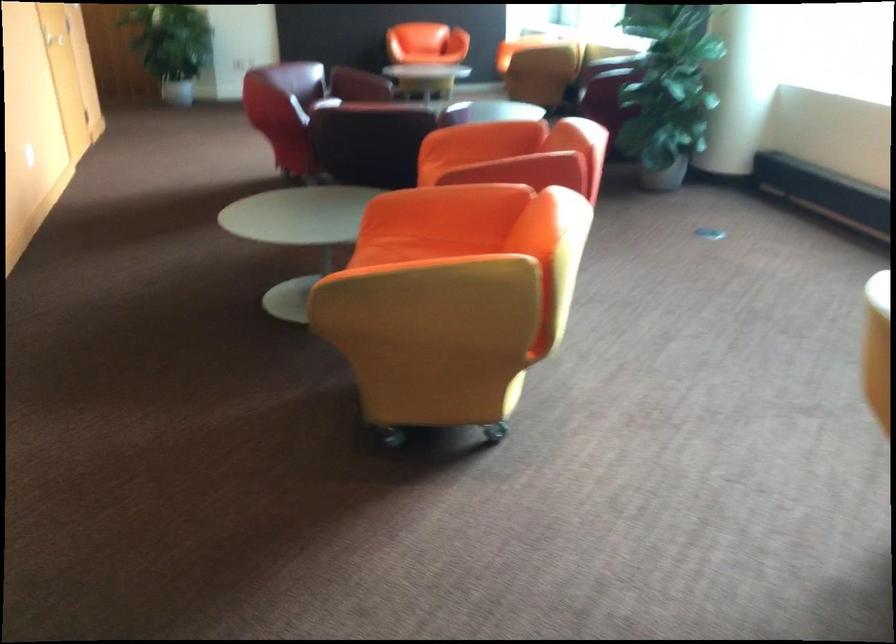
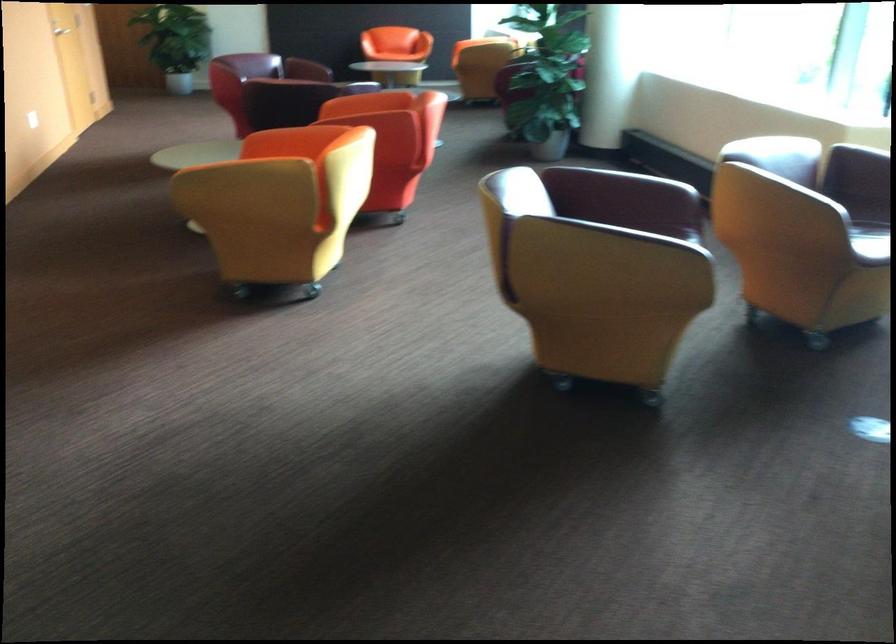
Locate, in the second image, the point that corresponds to (x=376, y=263) in the first image.

(220, 167)